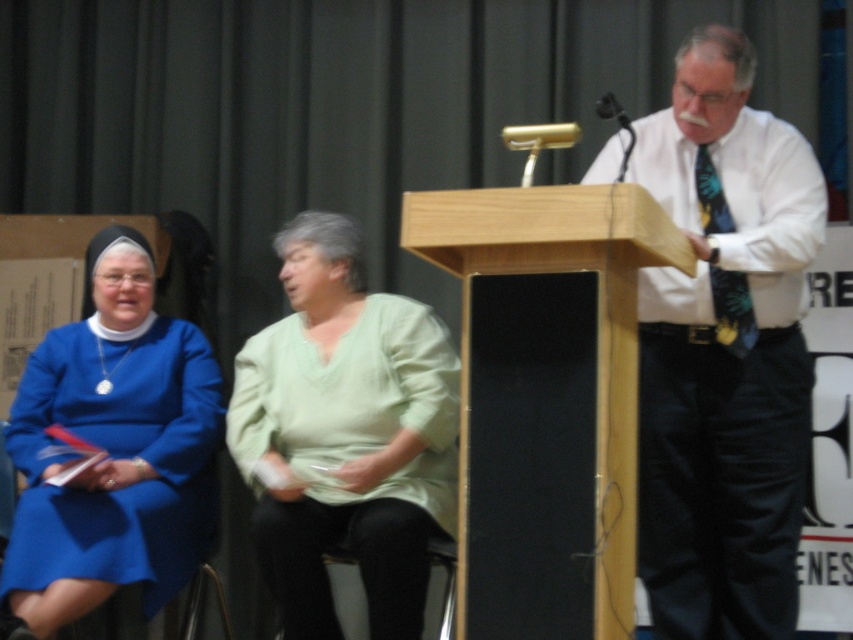
You are an event organizer at the ceremony and want to ensure proper seating arrangements. Which of the two individuals at the center, the white shirt at center or the green cotton shirt at center, is taller?

The white shirt at center is taller than the green cotton shirt at center.

What is located at the coordinates point (722,348)?

The white shirt at center is located at point (722,348).